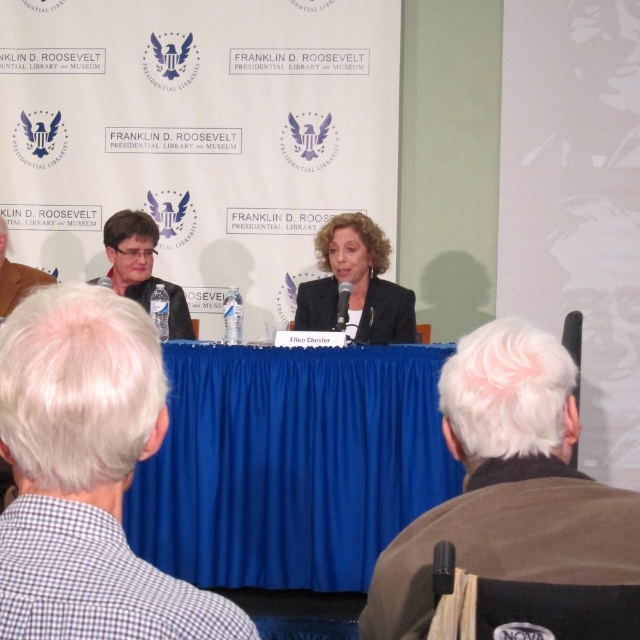
Question: Which of these objects is positioned farthest from the blue fabric table at center?

Choices:
 (A) brown wool jacket at lower right
 (B) matte black suit at center
 (C) matte black jacket at left
 (D) checkered fabric shirt at lower left

Answer: (D)

Question: Which point is closer to the camera taking this photo?

Choices:
 (A) (60, 314)
 (B) (189, 548)
 (C) (120, 227)

Answer: (A)

Question: Is blue fabric table at center in front of checkered fabric shirt at lower left?

Choices:
 (A) yes
 (B) no

Answer: (B)

Question: Where is checkered fabric shirt at lower left located in relation to brown wool jacket at lower right in the image?

Choices:
 (A) left
 (B) right

Answer: (A)

Question: Which object appears farthest from the camera in this image?

Choices:
 (A) brown wool jacket at lower right
 (B) matte black jacket at left

Answer: (B)

Question: Does matte black suit at center have a lesser width compared to matte black jacket at left?

Choices:
 (A) yes
 (B) no

Answer: (B)